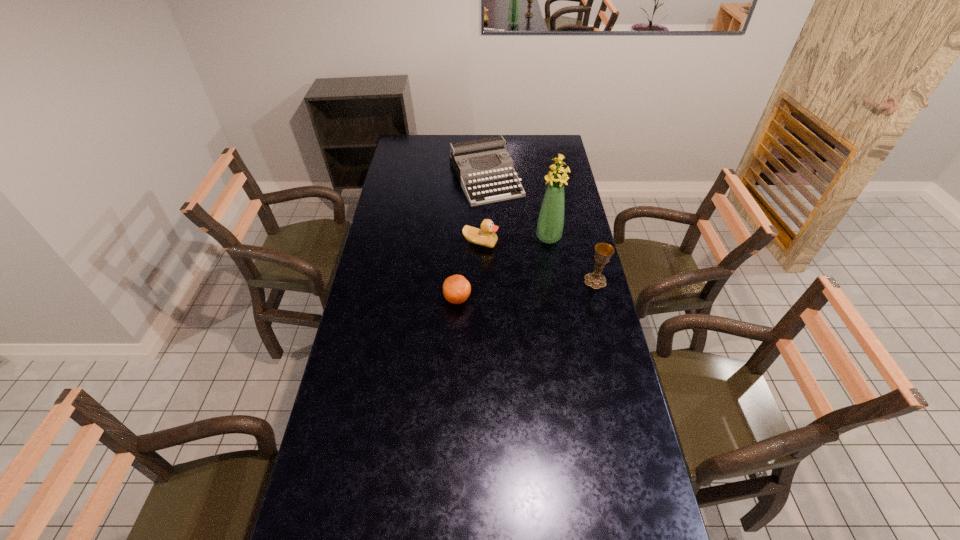
Identify the location of orange. (456, 289).

Image resolution: width=960 pixels, height=540 pixels. I want to click on the rightmost object, so click(x=603, y=251).

Identify the location of chalice. tap(603, 251).

The image size is (960, 540). I want to click on bouquet, so click(550, 224).

Find the location of `the second object from right to left`. the second object from right to left is located at coordinates (550, 224).

In order to click on typewriter in this screenshot , I will do `click(484, 150)`.

The height and width of the screenshot is (540, 960). Find the location of `duck`. duck is located at coordinates (486, 236).

Locate an element on the screen. free space located on the right of the orange is located at coordinates (557, 299).

I want to click on vacant position located on the left of the rightmost object, so click(515, 281).

Find the location of a particular element. free location located on the front-facing side of the bouquet is located at coordinates (533, 261).